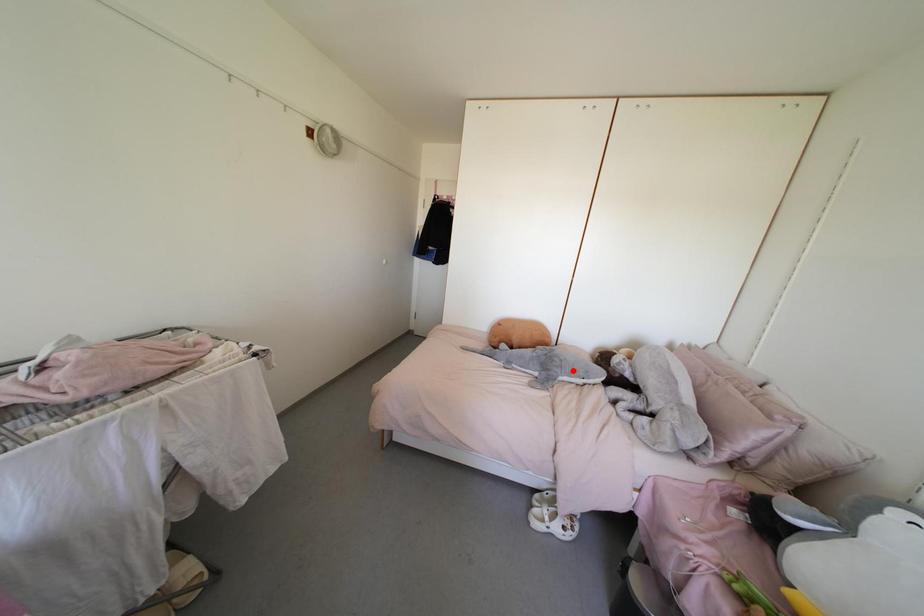
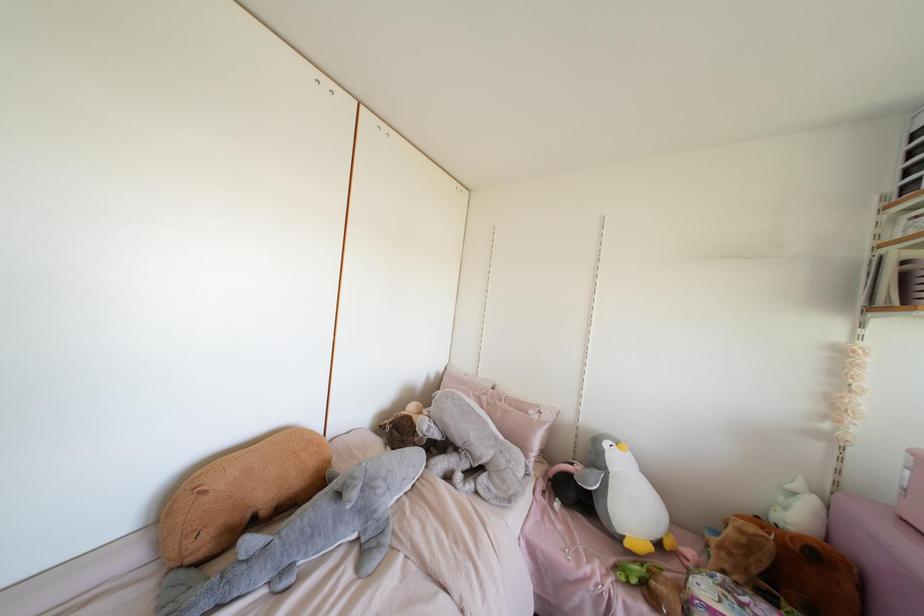
Find the pixel in the second image that matches the highlighted location in the first image.

(403, 479)